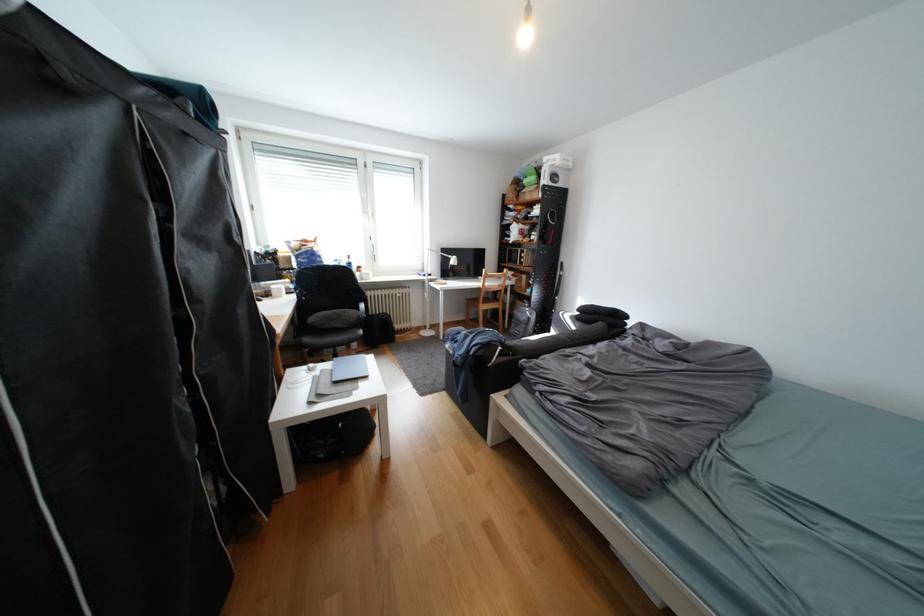
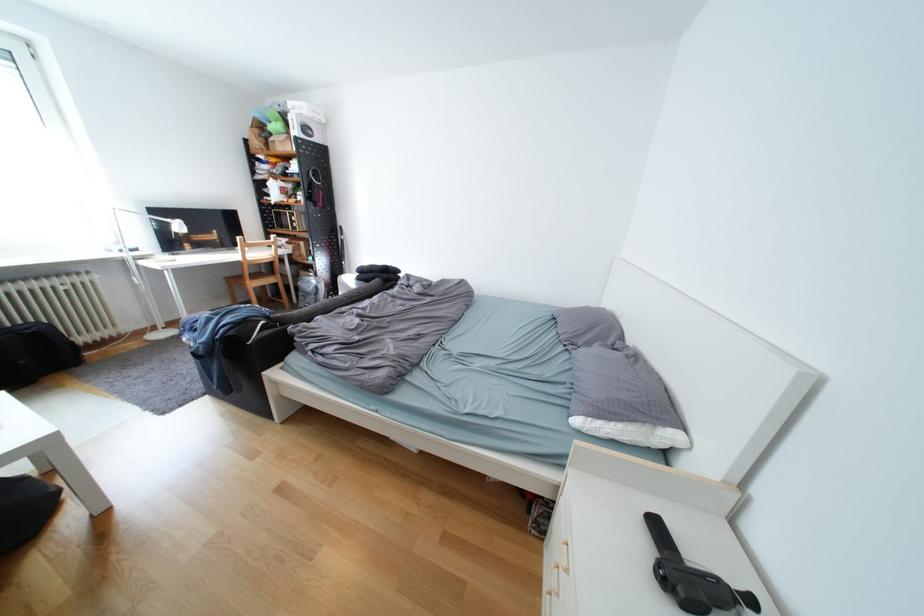
In the second image, find the point that corresponds to [495,307] in the first image.

(265, 285)